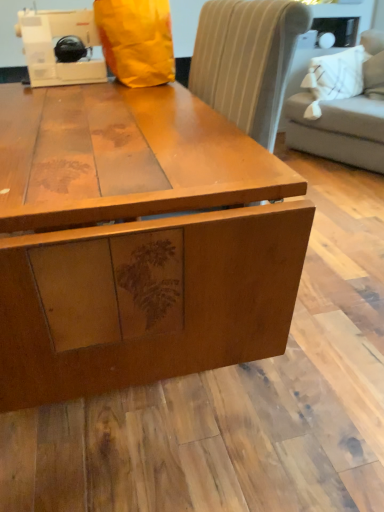
What do you see at coordinates (142, 251) in the screenshot?
I see `matte wood table at center` at bounding box center [142, 251].

What do you see at coordinates (338, 129) in the screenshot? This screenshot has width=384, height=512. I see `light gray fabric couch at upper right` at bounding box center [338, 129].

Where is `white plastic sewing machine at upper left`? This screenshot has height=512, width=384. white plastic sewing machine at upper left is located at coordinates (53, 46).

Is white plastic sewing machine at upper left in front of or behind matte wood table at center in the image?

white plastic sewing machine at upper left is behind matte wood table at center.

Considering the points (64, 79) and (101, 277), which point is in front, point (64, 79) or point (101, 277)?

Point (101, 277)

From the image's perspective, which one is positioned higher, white plastic sewing machine at upper left or matte wood table at center?

From the image's view, white plastic sewing machine at upper left is above.

Considering the sizes of white plastic sewing machine at upper left and light gray fabric couch at upper right in the image, is white plastic sewing machine at upper left taller or shorter than light gray fabric couch at upper right?

white plastic sewing machine at upper left is shorter than light gray fabric couch at upper right.

How many degrees apart are the facing directions of white plastic sewing machine at upper left and light gray fabric couch at upper right?

white plastic sewing machine at upper left and light gray fabric couch at upper right are facing 68.6 degrees away from each other.

Is white plastic sewing machine at upper left oriented towards light gray fabric couch at upper right?

No, white plastic sewing machine at upper left is not aimed at light gray fabric couch at upper right.

The height and width of the screenshot is (512, 384). I want to click on sewing machine that appears in front of the light gray fabric couch at upper right, so click(x=53, y=46).

From a real-world perspective, which is physically above, matte wood table at center or white plastic sewing machine at upper left?

white plastic sewing machine at upper left is physically above.

Considering the relative positions of matte wood table at center and white plastic sewing machine at upper left in the image provided, is matte wood table at center to the right of white plastic sewing machine at upper left from the viewer's perspective?

Correct, you'll find matte wood table at center to the right of white plastic sewing machine at upper left.

Considering their positions, is matte wood table at center located in front of or behind white plastic sewing machine at upper left?

matte wood table at center is in front of white plastic sewing machine at upper left.

Is light gray fabric couch at upper right facing towards matte wood table at center?

Yes.

From the image's perspective, is light gray fabric couch at upper right located above matte wood table at center?

Yes.

Is light gray fabric couch at upper right taller or shorter than matte wood table at center?

In the image, light gray fabric couch at upper right appears to be taller than matte wood table at center.

In the scene shown: Which object is wider, light gray fabric couch at upper right or white plastic sewing machine at upper left?

With larger width is light gray fabric couch at upper right.

From the image's perspective, which one is positioned lower, light gray fabric couch at upper right or white plastic sewing machine at upper left?

white plastic sewing machine at upper left appears lower in the image.

Can you confirm if light gray fabric couch at upper right is positioned to the right of white plastic sewing machine at upper left?

Indeed, light gray fabric couch at upper right is positioned on the right side of white plastic sewing machine at upper left.

Is matte wood table at center positioned with its back to light gray fabric couch at upper right?

That's not correct — matte wood table at center is not looking away from light gray fabric couch at upper right.

Who is shorter, matte wood table at center or light gray fabric couch at upper right?

matte wood table at center.

Who is smaller, matte wood table at center or light gray fabric couch at upper right?

With smaller size is matte wood table at center.

Considering the sizes of objects matte wood table at center and light gray fabric couch at upper right in the image provided, who is thinner, matte wood table at center or light gray fabric couch at upper right?

With smaller width is light gray fabric couch at upper right.

The width and height of the screenshot is (384, 512). Identify the location of table below the white plastic sewing machine at upper left (from the image's perspective). (142, 251).

Image resolution: width=384 pixels, height=512 pixels. I want to click on studio couch that is on the right side of white plastic sewing machine at upper left, so click(x=338, y=129).

Which object lies nearer to the anchor point white plastic sewing machine at upper left, matte wood table at center or light gray fabric couch at upper right?

matte wood table at center lies closer to white plastic sewing machine at upper left than the other object.

Based on the photo, based on their spatial positions, is light gray fabric couch at upper right or matte wood table at center closer to white plastic sewing machine at upper left?

matte wood table at center.

Based on their spatial positions, is white plastic sewing machine at upper left or light gray fabric couch at upper right further from matte wood table at center?

light gray fabric couch at upper right is positioned further to the anchor matte wood table at center.

Estimate the real-world distances between objects in this image. Which object is closer to light gray fabric couch at upper right, white plastic sewing machine at upper left or matte wood table at center?

white plastic sewing machine at upper left lies closer to light gray fabric couch at upper right than the other object.

Which object lies further to the anchor point light gray fabric couch at upper right, matte wood table at center or white plastic sewing machine at upper left?

matte wood table at center lies further to light gray fabric couch at upper right than the other object.

Considering their positions, is light gray fabric couch at upper right positioned closer to matte wood table at center than white plastic sewing machine at upper left?

white plastic sewing machine at upper left lies closer to matte wood table at center than the other object.

Locate an element on the screen. This screenshot has height=512, width=384. table located between white plastic sewing machine at upper left and light gray fabric couch at upper right in the left-right direction is located at coordinates (142, 251).